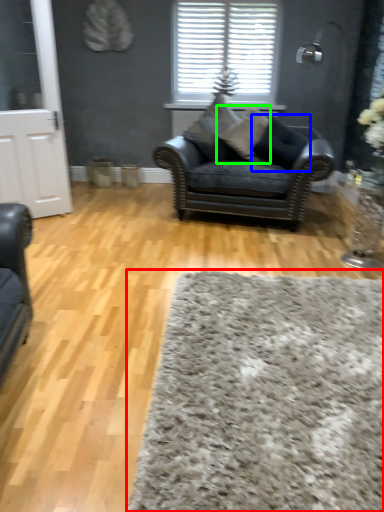
Question: Which object is the farthest from plain (highlighted by a red box)? Choose among these: pillow (highlighted by a blue box) or pillow (highlighted by a green box).

Choices:
 (A) pillow
 (B) pillow

Answer: (B)